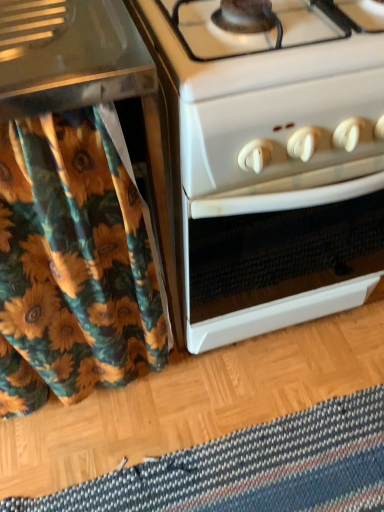
Question: From a real-world perspective, is floral fabric shower curtain at left physically located above or below white glossy oven at center?

Choices:
 (A) below
 (B) above

Answer: (B)

Question: Looking at their shapes, would you say floral fabric shower curtain at left is wider or thinner than white glossy oven at center?

Choices:
 (A) thin
 (B) wide

Answer: (A)

Question: Based on their relative distances, which object is farther from the striped woolen mat at lower center?

Choices:
 (A) white glossy oven at center
 (B) floral fabric shower curtain at left

Answer: (A)

Question: Estimate the real-world distances between objects in this image. Which object is closer to the striped woolen mat at lower center?

Choices:
 (A) floral fabric shower curtain at left
 (B) white glossy oven at center

Answer: (A)